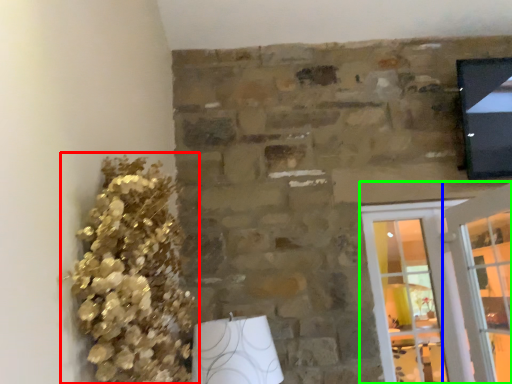
Question: Considering the real-world distances, which object is farthest from floral arrangement (highlighted by a red box)? glass door (highlighted by a blue box) or screen door (highlighted by a green box)?

Choices:
 (A) glass door
 (B) screen door

Answer: (A)